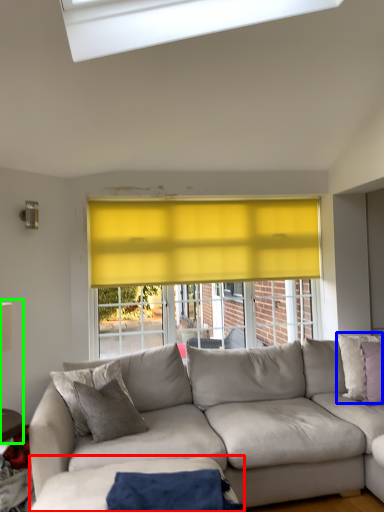
Question: Which is nearer to the plain (highlighted by a red box)? pillow (highlighted by a blue box) or table lamp (highlighted by a green box).

Choices:
 (A) pillow
 (B) table lamp

Answer: (B)